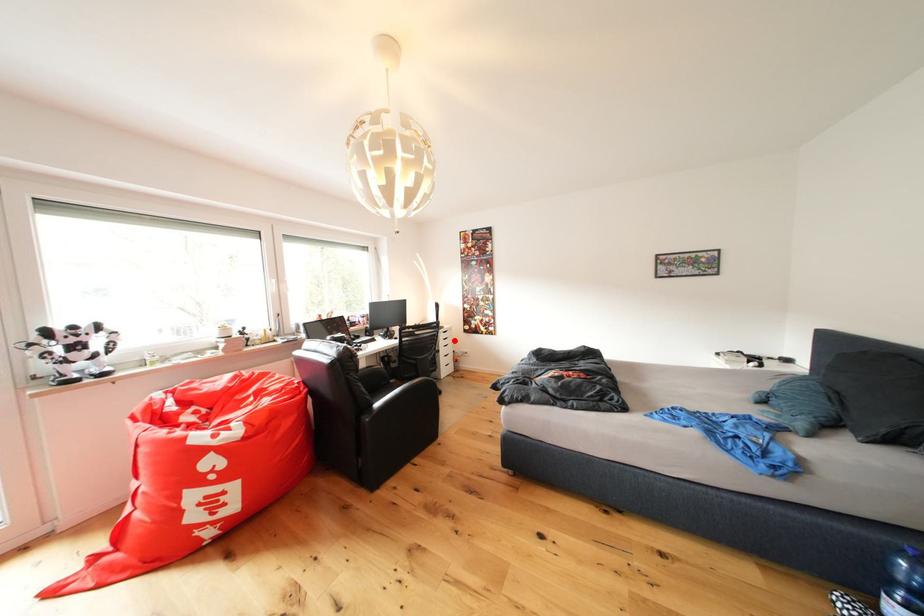
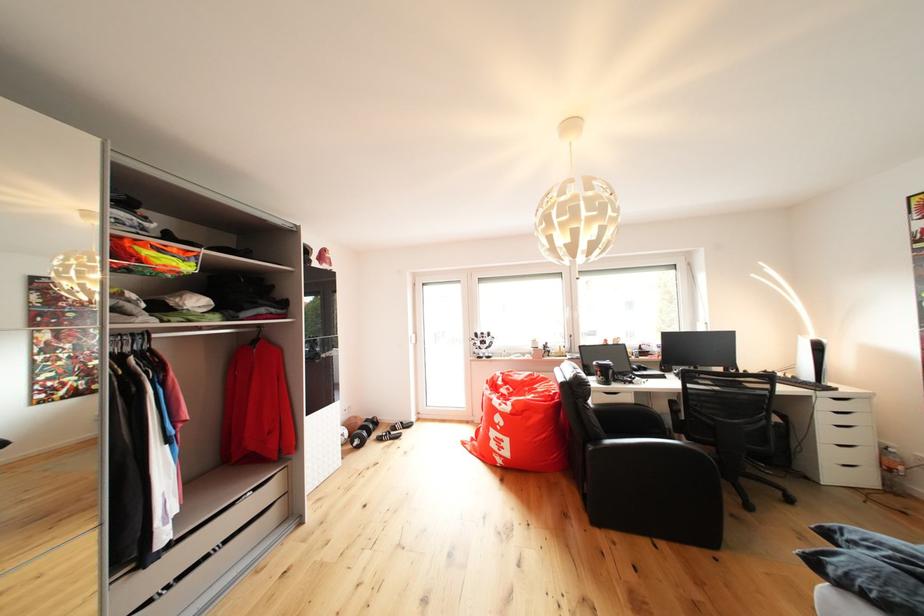
In the second image, find the point that corresponds to the highlighted location in the first image.

(850, 411)